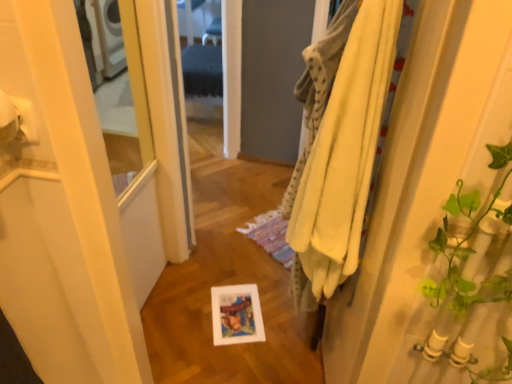
Question: Would you say yellow cotton bath towel at right, the 1th bath towel when ordered from top to bottom, is outside yellow soft towel at right, acting as the second bath towel starting from the top?

Choices:
 (A) yes
 (B) no

Answer: (A)

Question: Is yellow cotton bath towel at right, the 1th bath towel when ordered from top to bottom, further to the viewer compared to yellow soft towel at right, acting as the second bath towel starting from the top?

Choices:
 (A) no
 (B) yes

Answer: (B)

Question: Is yellow cotton bath towel at right, the 2th bath towel when ordered from bottom to top, in contact with yellow soft towel at right, acting as the second bath towel starting from the top?

Choices:
 (A) yes
 (B) no

Answer: (A)

Question: Is yellow cotton bath towel at right, the 2th bath towel when ordered from bottom to top, at the right side of yellow soft towel at right, acting as the second bath towel starting from the top?

Choices:
 (A) yes
 (B) no

Answer: (B)

Question: From the image's perspective, would you say yellow cotton bath towel at right, the 1th bath towel when ordered from top to bottom, is shown under yellow soft towel at right, acting as the second bath towel starting from the top?

Choices:
 (A) yes
 (B) no

Answer: (B)

Question: Is yellow cotton bath towel at right, the 1th bath towel when ordered from top to bottom, surrounding yellow soft towel at right, the 1th bath towel ordered from the bottom?

Choices:
 (A) yes
 (B) no

Answer: (A)

Question: Is yellow cotton bath towel at right, the 1th bath towel when ordered from top to bottom, positioned beyond the bounds of white matte toilet paper at upper left?

Choices:
 (A) yes
 (B) no

Answer: (A)

Question: Does yellow cotton bath towel at right, the 2th bath towel when ordered from bottom to top, have a larger size compared to white matte toilet paper at upper left?

Choices:
 (A) yes
 (B) no

Answer: (A)

Question: Is white matte toilet paper at upper left located within yellow cotton bath towel at right, the 1th bath towel when ordered from top to bottom?

Choices:
 (A) no
 (B) yes

Answer: (A)

Question: Can you confirm if yellow cotton bath towel at right, the 1th bath towel when ordered from top to bottom, is thinner than white matte toilet paper at upper left?

Choices:
 (A) yes
 (B) no

Answer: (B)

Question: From a real-world perspective, is yellow cotton bath towel at right, the 2th bath towel when ordered from bottom to top, on white matte toilet paper at upper left?

Choices:
 (A) yes
 (B) no

Answer: (B)

Question: Is yellow cotton bath towel at right, the 1th bath towel when ordered from top to bottom, smaller than white matte toilet paper at upper left?

Choices:
 (A) yes
 (B) no

Answer: (B)

Question: Does yellow fabric at right have a greater height compared to yellow cotton bath towel at right, the 1th bath towel when ordered from top to bottom?

Choices:
 (A) no
 (B) yes

Answer: (B)